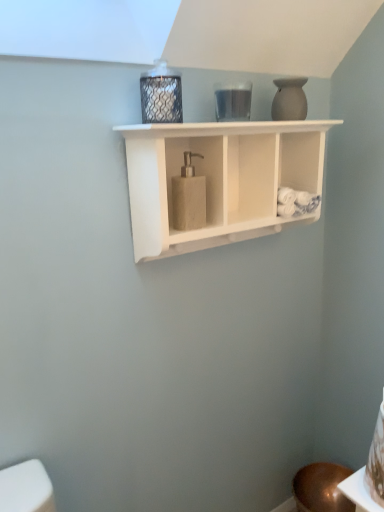
Question: Is beige textured soap dispenser at center not close to white matte soap dispenser at center?

Choices:
 (A) no
 (B) yes

Answer: (A)

Question: Can you confirm if beige textured soap dispenser at center is shorter than white matte soap dispenser at center?

Choices:
 (A) no
 (B) yes

Answer: (B)

Question: From the image's perspective, is beige textured soap dispenser at center on white matte soap dispenser at center?

Choices:
 (A) yes
 (B) no

Answer: (B)

Question: Is beige textured soap dispenser at center with white matte soap dispenser at center?

Choices:
 (A) yes
 (B) no

Answer: (B)

Question: Is beige textured soap dispenser at center turned away from white matte soap dispenser at center?

Choices:
 (A) yes
 (B) no

Answer: (A)

Question: Is beige textured soap dispenser at center smaller than white matte soap dispenser at center?

Choices:
 (A) no
 (B) yes

Answer: (B)

Question: Does matte white vase at upper right come behind beige textured soap dispenser at center?

Choices:
 (A) yes
 (B) no

Answer: (A)

Question: Can you confirm if matte white vase at upper right is positioned to the left of beige textured soap dispenser at center?

Choices:
 (A) yes
 (B) no

Answer: (B)

Question: Does matte white vase at upper right have a greater height compared to beige textured soap dispenser at center?

Choices:
 (A) no
 (B) yes

Answer: (A)

Question: From the image's perspective, is matte white vase at upper right below beige textured soap dispenser at center?

Choices:
 (A) no
 (B) yes

Answer: (A)

Question: From a real-world perspective, is matte white vase at upper right on beige textured soap dispenser at center?

Choices:
 (A) no
 (B) yes

Answer: (B)

Question: Considering the relative sizes of matte white vase at upper right and beige textured soap dispenser at center in the image provided, is matte white vase at upper right shorter than beige textured soap dispenser at center?

Choices:
 (A) no
 (B) yes

Answer: (B)

Question: Is there a large distance between white matte soap dispenser at center and matte white vase at upper right?

Choices:
 (A) yes
 (B) no

Answer: (B)